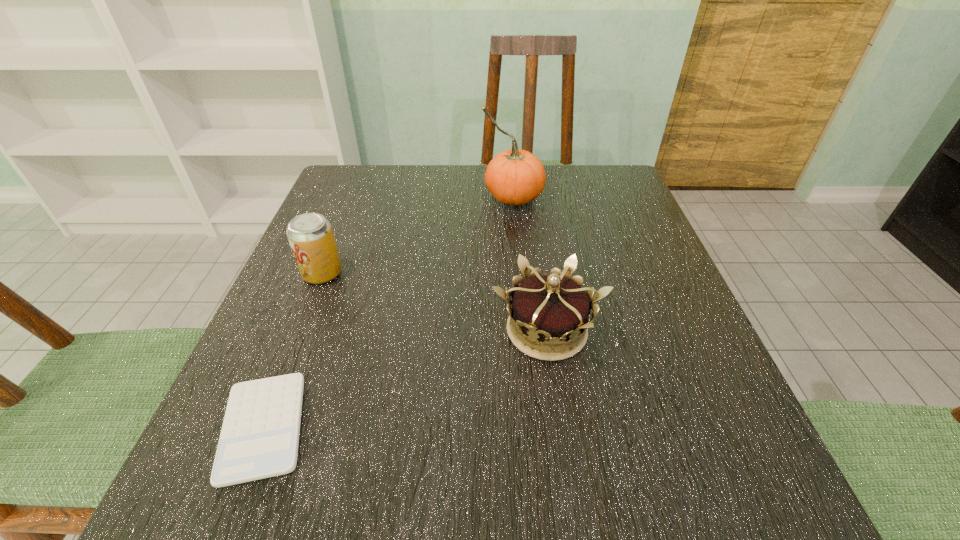
Image resolution: width=960 pixels, height=540 pixels. In order to click on free space at the far left corner of the desktop in this screenshot , I will do `click(387, 193)`.

Where is `vacant region at the far right corner`? vacant region at the far right corner is located at coordinates (627, 193).

This screenshot has height=540, width=960. Identify the location of vacant area at the near right corner. (653, 515).

The width and height of the screenshot is (960, 540). Identify the location of vacant point located between the calculator and the crown. (405, 379).

Image resolution: width=960 pixels, height=540 pixels. Find the location of `empty space between the farthest object and the nearest object`. empty space between the farthest object and the nearest object is located at coordinates (388, 312).

Image resolution: width=960 pixels, height=540 pixels. I want to click on vacant space that is in between the nearest object and the second nearest object, so click(x=405, y=379).

Find the location of a particular element. unoccupied area between the tallest object and the pop (soda) is located at coordinates (418, 235).

Identify the location of free space between the third farthest object and the shortest object. Image resolution: width=960 pixels, height=540 pixels. (405, 379).

The width and height of the screenshot is (960, 540). I want to click on unoccupied area between the third nearest object and the farthest object, so click(x=418, y=235).

Where is `vacant region between the second nearest object and the third nearest object`? This screenshot has height=540, width=960. vacant region between the second nearest object and the third nearest object is located at coordinates (435, 302).